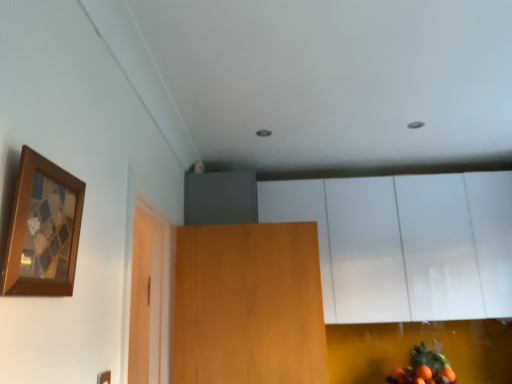
Question: From the image's perspective, does orange matte fruit at lower right appear lower than wooden door at center?

Choices:
 (A) no
 (B) yes

Answer: (B)

Question: Considering the relative positions of orange matte fruit at lower right and wooden door at center in the image provided, is orange matte fruit at lower right to the right of wooden door at center from the viewer's perspective?

Choices:
 (A) yes
 (B) no

Answer: (A)

Question: From a real-world perspective, is orange matte fruit at lower right beneath wooden door at center?

Choices:
 (A) yes
 (B) no

Answer: (A)

Question: Does orange matte fruit at lower right have a greater width compared to wooden door at center?

Choices:
 (A) yes
 (B) no

Answer: (A)

Question: Considering the relative sizes of orange matte fruit at lower right and wooden door at center in the image provided, is orange matte fruit at lower right shorter than wooden door at center?

Choices:
 (A) yes
 (B) no

Answer: (A)

Question: Would you say white glossy cabinet at upper center is to the left or to the right of orange matte fruit at lower right in the picture?

Choices:
 (A) right
 (B) left

Answer: (B)

Question: Looking at the image, does white glossy cabinet at upper center seem bigger or smaller compared to orange matte fruit at lower right?

Choices:
 (A) big
 (B) small

Answer: (A)

Question: Considering their positions, is white glossy cabinet at upper center located in front of or behind orange matte fruit at lower right?

Choices:
 (A) behind
 (B) front

Answer: (A)

Question: From the image's perspective, is white glossy cabinet at upper center located above or below orange matte fruit at lower right?

Choices:
 (A) below
 (B) above

Answer: (B)

Question: From the image's perspective, is orange matte fruit at lower right located above or below wooden picture frame at upper left?

Choices:
 (A) below
 (B) above

Answer: (A)

Question: Is orange matte fruit at lower right wider or thinner than wooden picture frame at upper left?

Choices:
 (A) wide
 (B) thin

Answer: (A)

Question: Visually, is orange matte fruit at lower right positioned to the left or to the right of wooden picture frame at upper left?

Choices:
 (A) left
 (B) right

Answer: (B)

Question: Is point (395, 375) positioned closer to the camera than point (19, 158)?

Choices:
 (A) closer
 (B) farther

Answer: (B)

Question: Is white glossy cabinet at upper center in front of or behind wooden picture frame at upper left in the image?

Choices:
 (A) front
 (B) behind

Answer: (B)

Question: Would you say white glossy cabinet at upper center is to the left or to the right of wooden picture frame at upper left in the picture?

Choices:
 (A) right
 (B) left

Answer: (A)